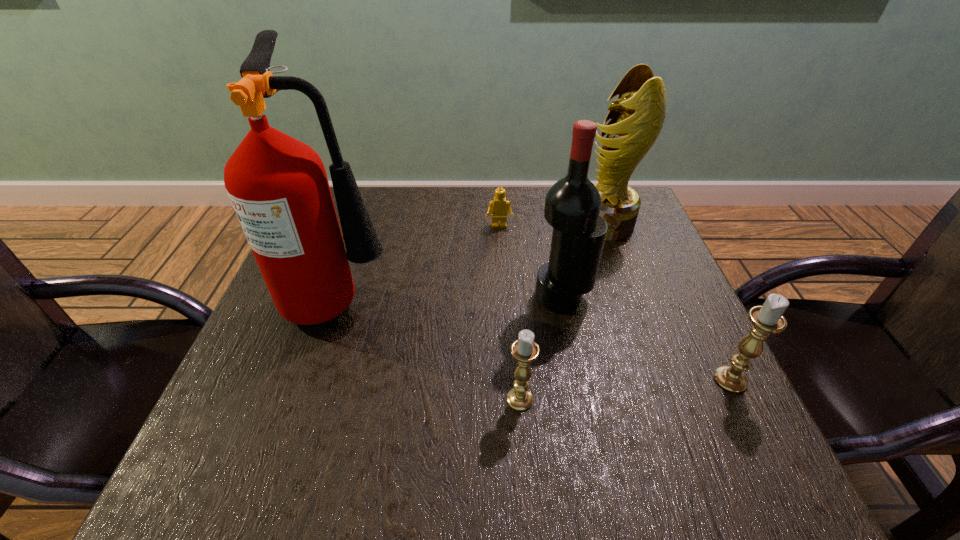
This screenshot has width=960, height=540. In order to click on the shorter candle holder in this screenshot , I will do `click(524, 350)`.

What are the coordinates of `the left candle holder` in the screenshot? It's located at (524, 350).

Image resolution: width=960 pixels, height=540 pixels. In order to click on the fourth tallest object in this screenshot , I will do `click(766, 319)`.

Locate an element on the screen. This screenshot has height=540, width=960. the right candle holder is located at coordinates (766, 319).

This screenshot has width=960, height=540. What are the coordinates of `Lego` in the screenshot? It's located at (498, 207).

You are a GUI agent. You are given a task and a screenshot of the screen. Output one action in this format:
    pyautogui.click(x=<x>, y=<y>)
    Task: Click on the award
    The image size is (960, 540).
    Given the screenshot: What is the action you would take?
    pyautogui.click(x=637, y=116)

At what (x,y) coordinates should I click in order to perform the action: click on the leftmost object. Please return your answer as a coordinate pair (x, y). The image size is (960, 540). Looking at the image, I should click on (278, 186).

Locate an element on the screen. the tallest object is located at coordinates (278, 186).

You are a GUI agent. You are given a task and a screenshot of the screen. Output one action in this format:
    pyautogui.click(x=<x>, y=<y>)
    Task: Click on the wine bottle
    
    Given the screenshot: What is the action you would take?
    pyautogui.click(x=572, y=206)

What are the coordinates of `vacant space located 0.250m on the right of the left candle holder` in the screenshot? It's located at (676, 399).